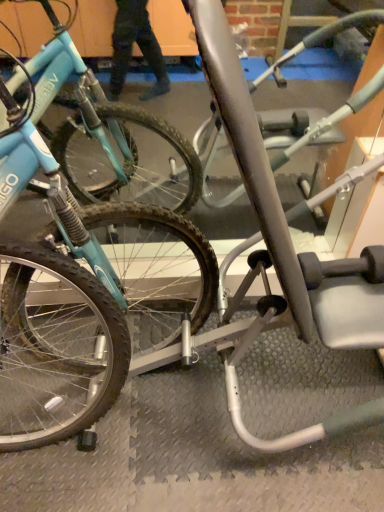
The image size is (384, 512). What do you see at coordinates (58, 160) in the screenshot?
I see `matte blue bicycle at left` at bounding box center [58, 160].

Identify the location of matte blue bicycle at left. [x=58, y=160].

What are the coordinates of `matte blue bicycle at left` in the screenshot? It's located at (58, 160).